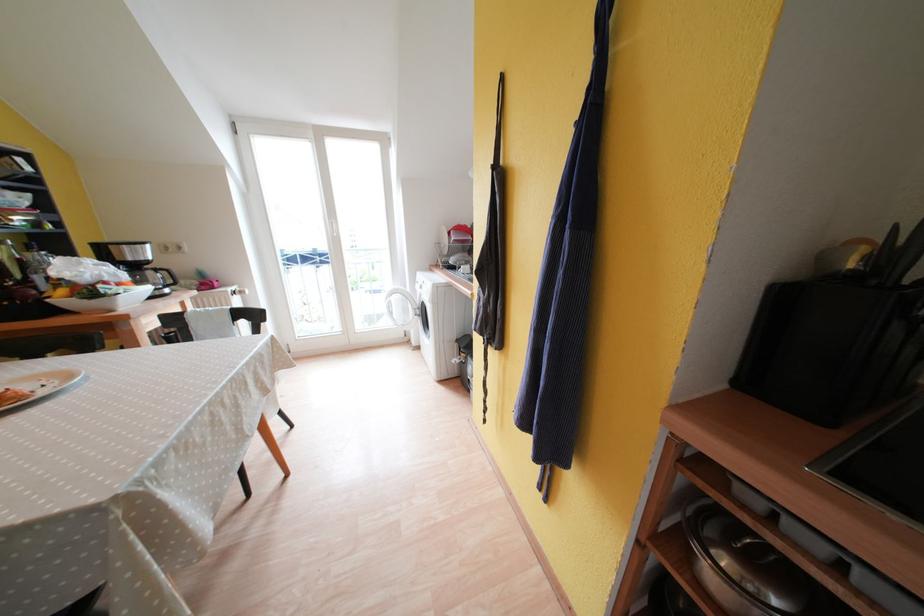
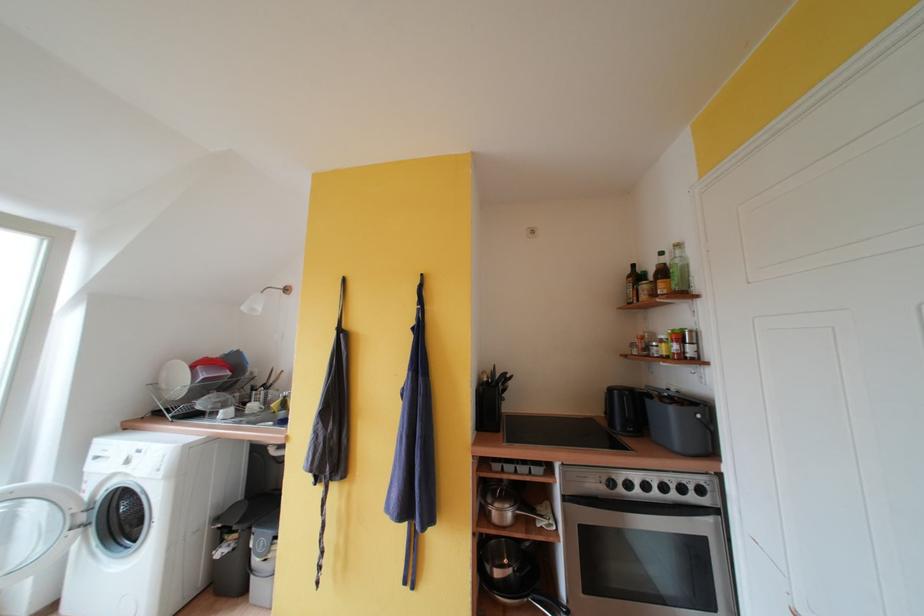
Find the pixel in the second image that matches [445,246] in the first image.

(160, 387)